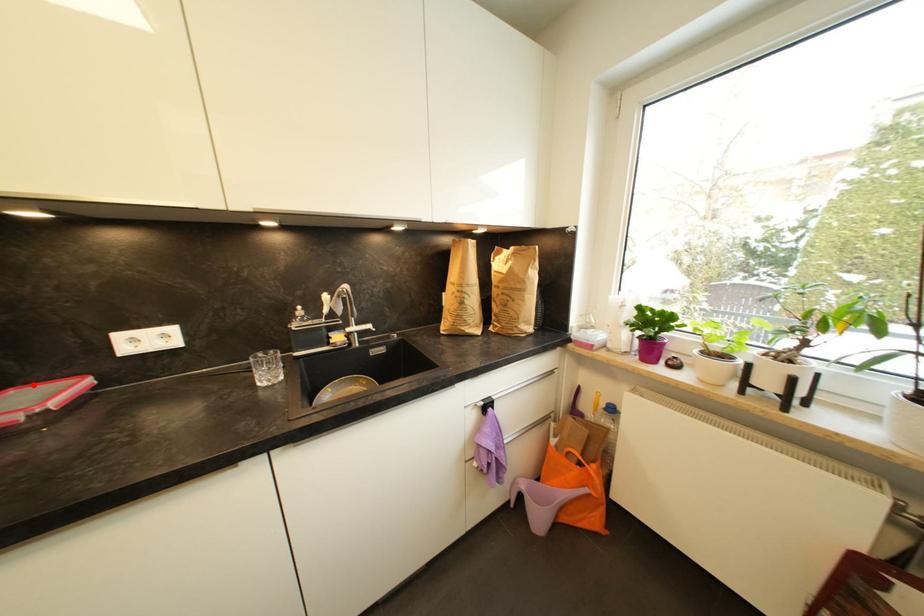
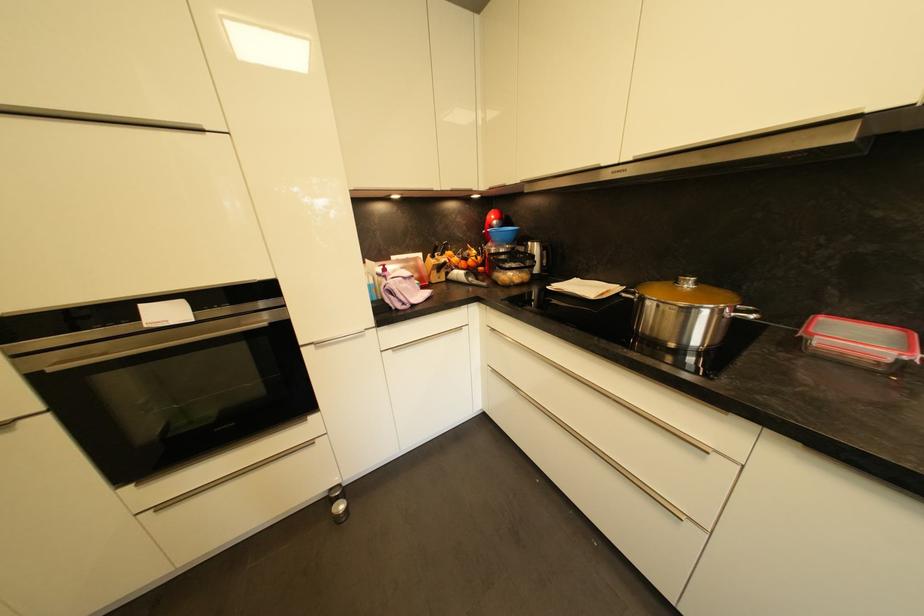
In the second image, find the point that corresponds to the highlighted location in the first image.

(836, 315)